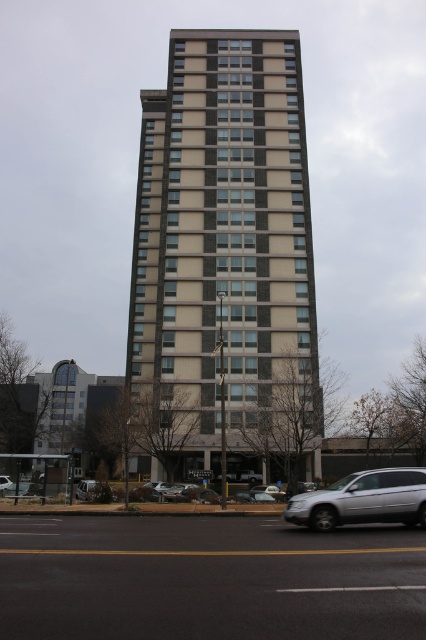
Question: Can you confirm if beige concrete building at center is positioned to the right of shiny silver sedan at center?

Choices:
 (A) no
 (B) yes

Answer: (A)

Question: Is the position of silver metallic suv at lower left less distant than that of silver metallic sedan at center?

Choices:
 (A) yes
 (B) no

Answer: (B)

Question: Which of these objects is positioned farthest from the shiny silver sedan at center?

Choices:
 (A) silver metallic suv at lower left
 (B) silver metallic suv at lower right
 (C) metallic silver sedan at lower center

Answer: (B)

Question: Which point is closer to the camera?

Choices:
 (A) silver metallic suv at lower right
 (B) shiny silver sedan at center
 (C) silver metallic suv at lower left
 (D) silver metallic sedan at center

Answer: (A)

Question: Is beige concrete building at center wider than satin silver suv at center?

Choices:
 (A) no
 (B) yes

Answer: (B)

Question: Which object is positioned farthest from the beige concrete building at center?

Choices:
 (A) silver metallic sedan at center
 (B) silver metallic suv at lower left
 (C) silver metallic suv at lower right

Answer: (C)